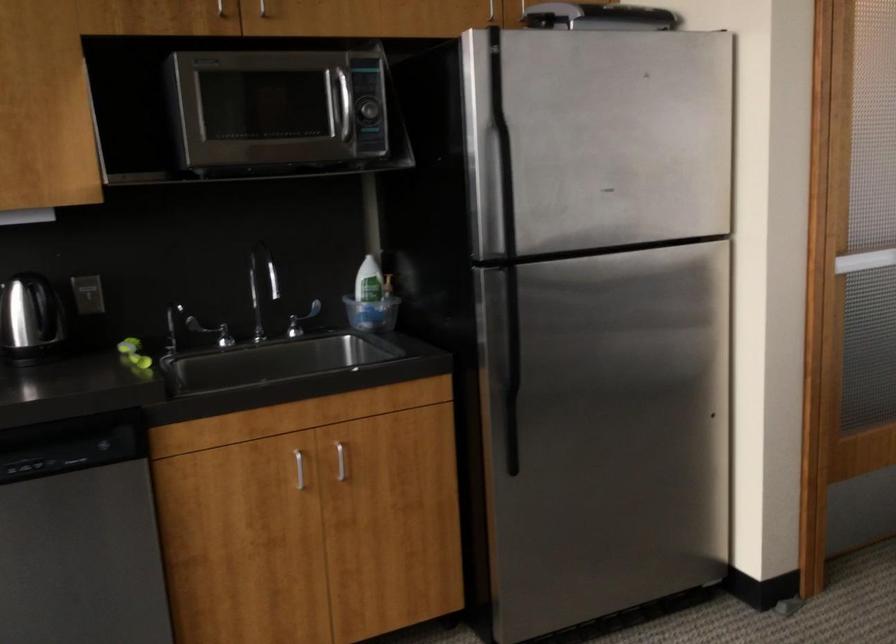
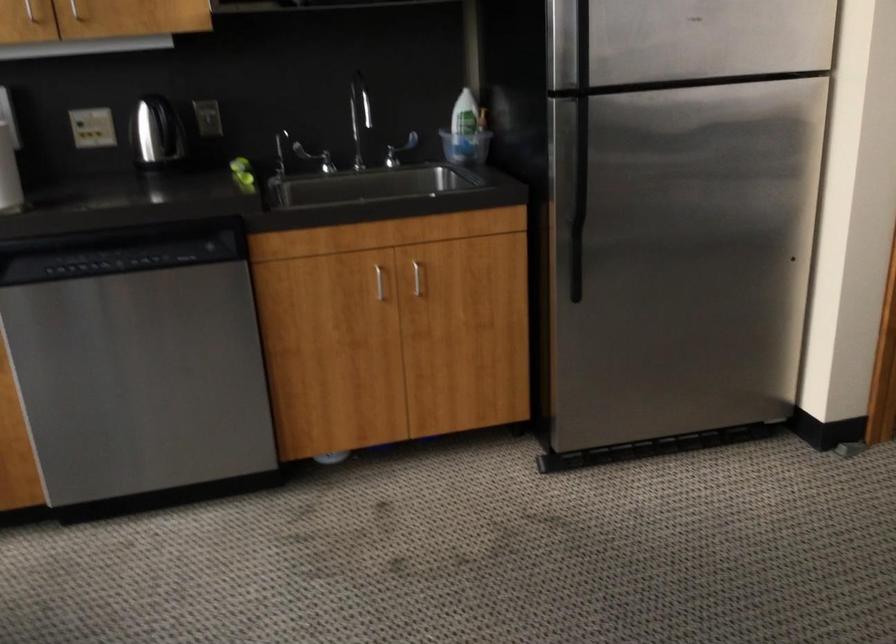
Question: The camera is either moving clockwise (left) or counter-clockwise (right) around the object. The first image is from the beginning of the video and the second image is from the end. Is the camera moving left or right when shooting the video?

Choices:
 (A) Left
 (B) Right

Answer: (B)